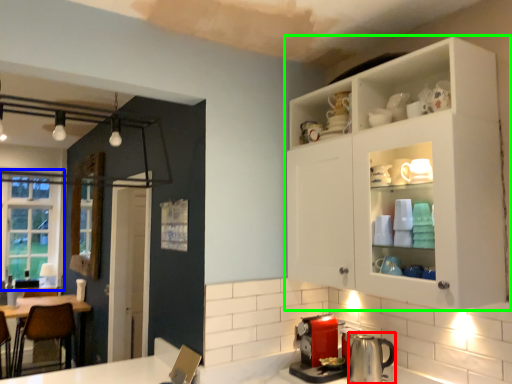
Question: Which object is positioned closest to appliance (highlighted by a red box)? Select from window (highlighted by a blue box) and cabinetry (highlighted by a green box).

Choices:
 (A) window
 (B) cabinetry

Answer: (B)